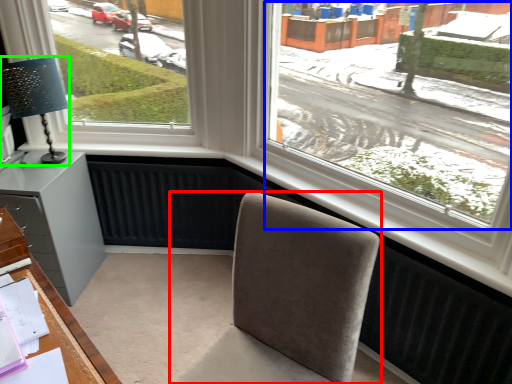
Question: Considering the real-world distances, which object is farthest from chair (highlighted by a red box)? window screen (highlighted by a blue box) or table lamp (highlighted by a green box)?

Choices:
 (A) window screen
 (B) table lamp

Answer: (B)